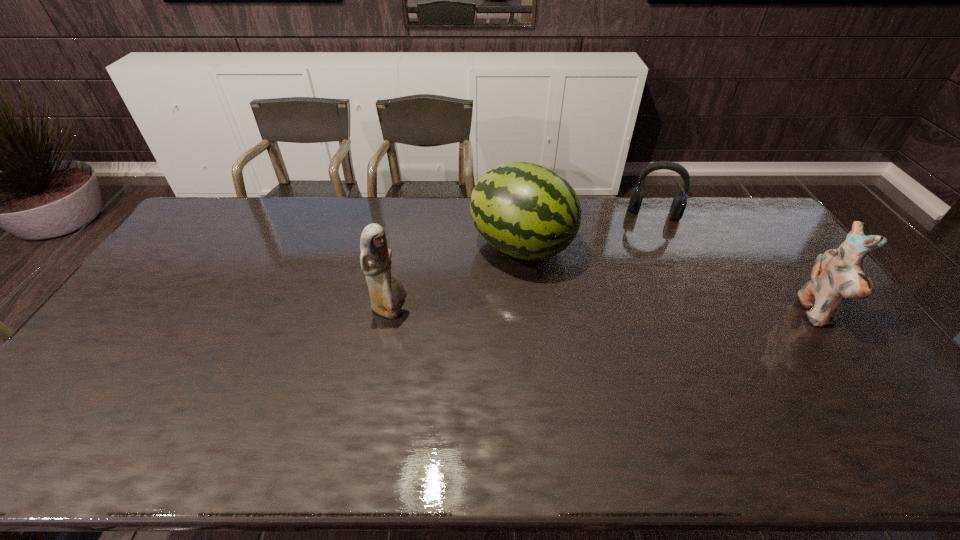
This screenshot has height=540, width=960. I want to click on the third closest object to the leftmost object, so click(x=837, y=274).

Image resolution: width=960 pixels, height=540 pixels. Find the location of `free spot that satisfies the following two spatial constraints: 1. on the back side of the second object from left to right; 2. on the left side of the shortest object`. free spot that satisfies the following two spatial constraints: 1. on the back side of the second object from left to right; 2. on the left side of the shortest object is located at coordinates (518, 213).